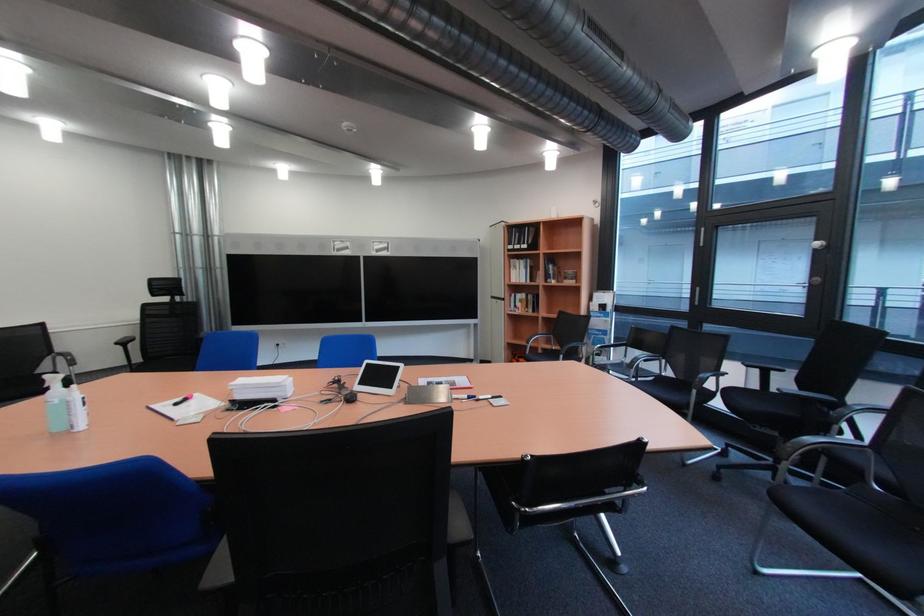
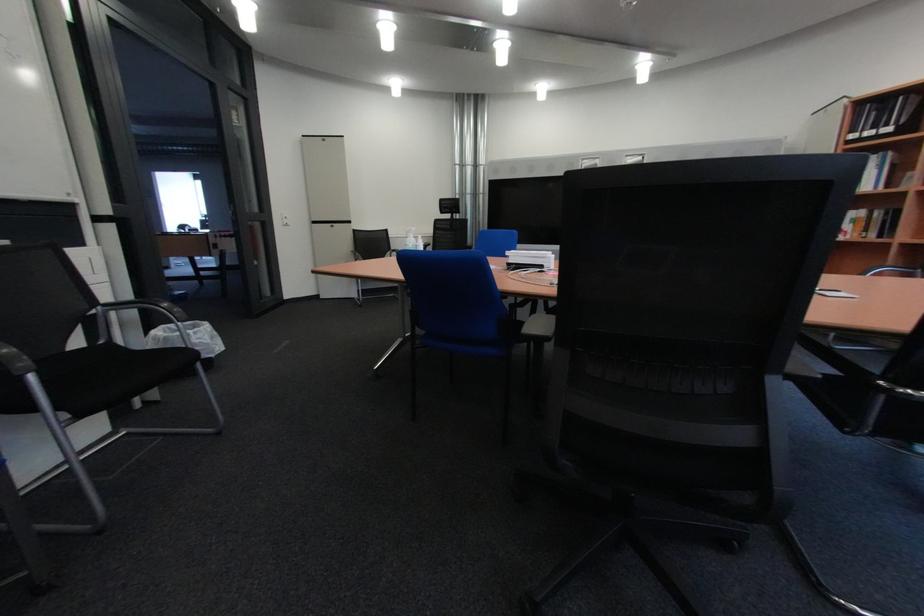
Question: The camera is either moving clockwise (left) or counter-clockwise (right) around the object. The first image is from the beginning of the video and the second image is from the end. Is the camera moving left or right when shooting the video?

Choices:
 (A) Left
 (B) Right

Answer: (B)